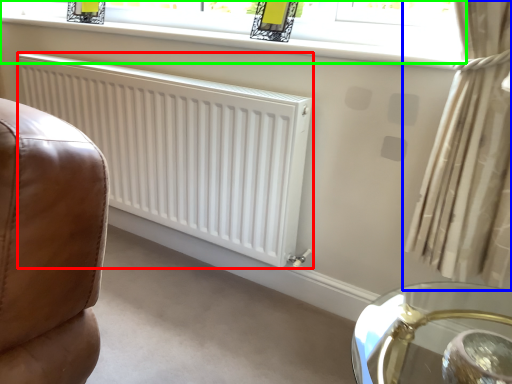
Question: Which object is the closest to the radiator (highlighted by a red box)? Choose among these: curtain (highlighted by a blue box) or window (highlighted by a green box).

Choices:
 (A) curtain
 (B) window

Answer: (B)